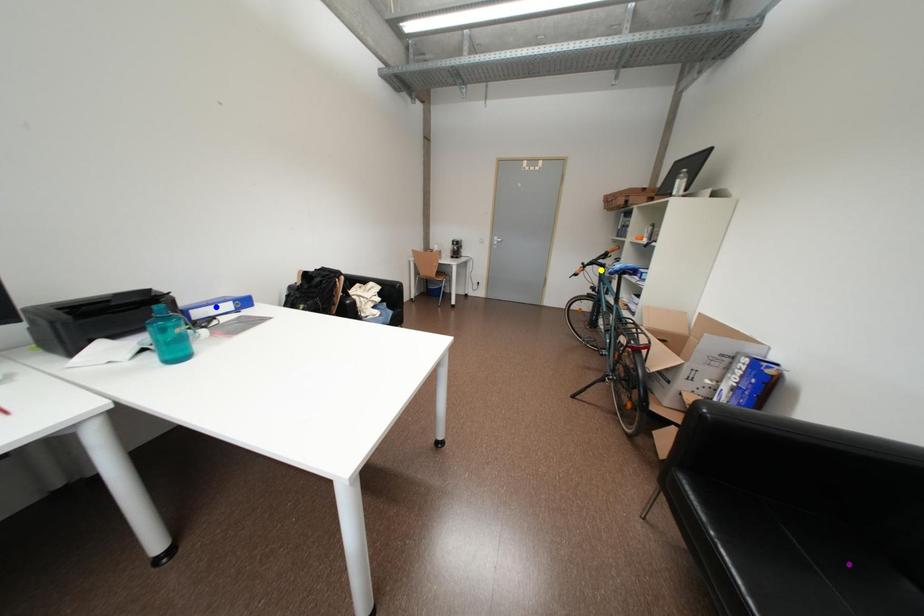
Order these from nearest to farthest:
A) purple point
B) yellow point
C) blue point

purple point < blue point < yellow point